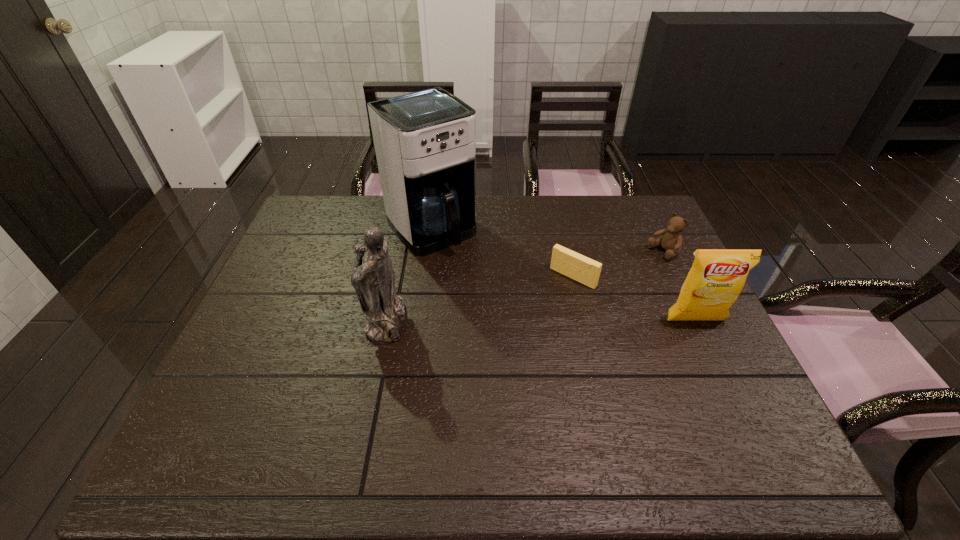
This screenshot has height=540, width=960. What are the coordinates of `vacant area between the third nearest object and the coffee maker` in the screenshot? It's located at (502, 253).

Identify the location of empty location between the third tallest object and the videotape. (635, 299).

The height and width of the screenshot is (540, 960). What are the coordinates of `vacant point located between the fourth tallest object and the third shortest object` in the screenshot? It's located at (680, 286).

Identify the location of blank region between the figurine and the videotape. (479, 298).

This screenshot has width=960, height=540. Find the location of `free space between the tallest object and the shortest object`. free space between the tallest object and the shortest object is located at coordinates (502, 253).

Image resolution: width=960 pixels, height=540 pixels. In order to click on vacant region between the third tallest object and the shortest object in this screenshot , I will do `click(635, 299)`.

Locate an element on the screen. vacant area that lies between the fourth shortest object and the third object from right to left is located at coordinates (479, 298).

The image size is (960, 540). Identify the location of vacant area that lies between the fourth shortest object and the teddy bear. (524, 286).

At what (x,y) coordinates should I click in order to perform the action: click on object that is the second nearest to the teddy bear. Please return your answer as a coordinate pair (x, y). The height and width of the screenshot is (540, 960). Looking at the image, I should click on (717, 277).

What are the coordinates of `object that is the second closest to the second shortest object` in the screenshot? It's located at (717, 277).